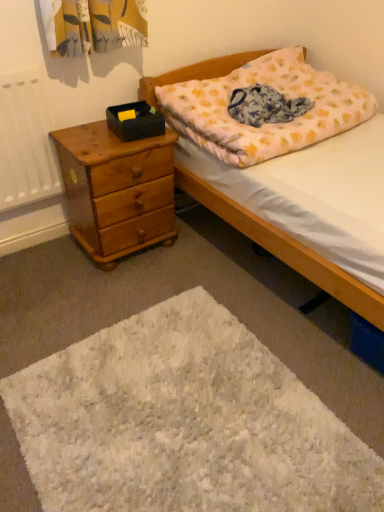
Locate an element on the screen. unoccupied region to the right of light brown wooden chest of drawers at left is located at coordinates (198, 255).